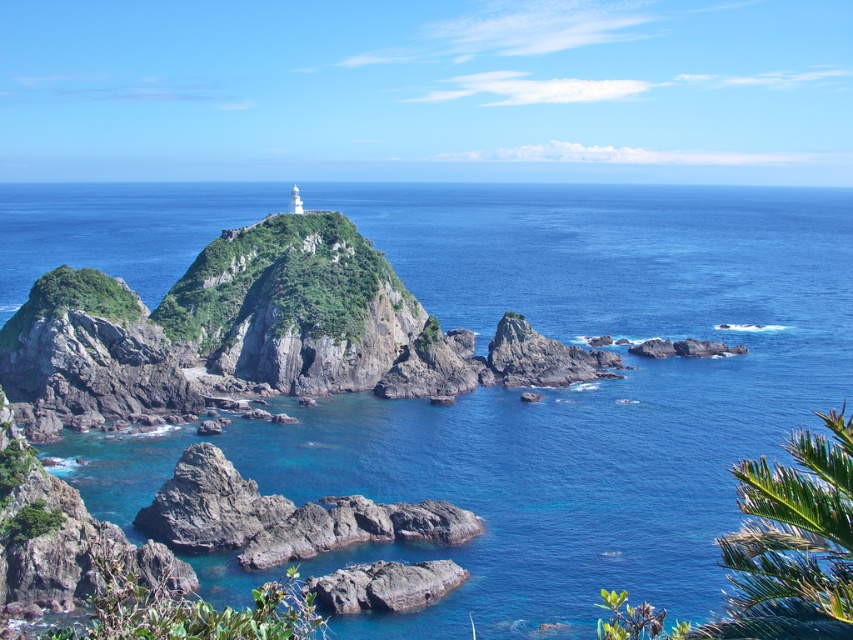
Is blue clear water at center below green leafy palm tree at lower right?

Incorrect, blue clear water at center is not positioned below green leafy palm tree at lower right.

In the scene shown: Is blue clear water at center closer to the viewer compared to green leafy palm tree at lower right?

No, it is behind green leafy palm tree at lower right.

Who is more distant from viewer, (809, 205) or (766, 614)?

The point (809, 205) is more distant.

Find the location of a particular element. This screenshot has height=640, width=853. blue clear water at center is located at coordinates 556,394.

Is blue clear water at center bigger than rough gray rock at lower center?

Yes, blue clear water at center is bigger than rough gray rock at lower center.

Does point (473, 291) lie behind point (421, 584)?

Yes, point (473, 291) is farther from viewer.

Which is behind, point (483, 428) or point (364, 582)?

Point (483, 428)

Where is `blue clear water at center`? blue clear water at center is located at coordinates (556, 394).

Does green leafy palm tree at lower right appear on the right side of rough gray rock at lower center?

Yes, green leafy palm tree at lower right is to the right of rough gray rock at lower center.

Can you confirm if green leafy palm tree at lower right is smaller than rough gray rock at lower center?

No.

Between point (820, 621) and point (396, 602), which one is positioned behind?

The point (396, 602) is behind.

You are a GUI agent. You are given a task and a screenshot of the screen. Output one action in this format:
    pyautogui.click(x=<x>, y=<y>)
    Task: Click on the green leafy palm tree at lower right
    The height and width of the screenshot is (640, 853).
    Given the screenshot: What is the action you would take?
    pyautogui.click(x=792, y=541)